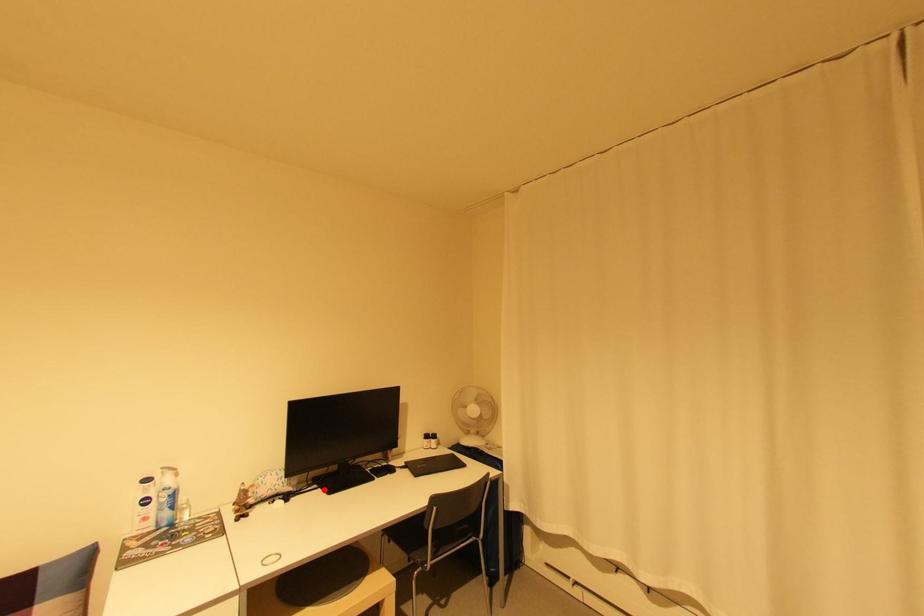
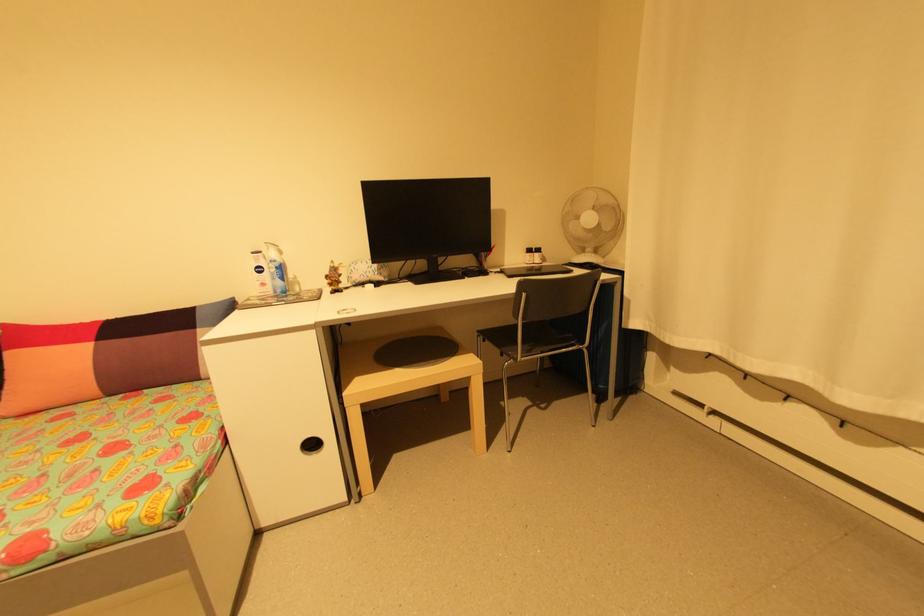
Question: I am providing you with two images of the same scene from different viewpoints. Image1 has a red point marked. In image2, the corresponding 3D location appears at what relative position? Reply with the corresponding letter.

Choices:
 (A) Closer
 (B) Farther

Answer: (A)